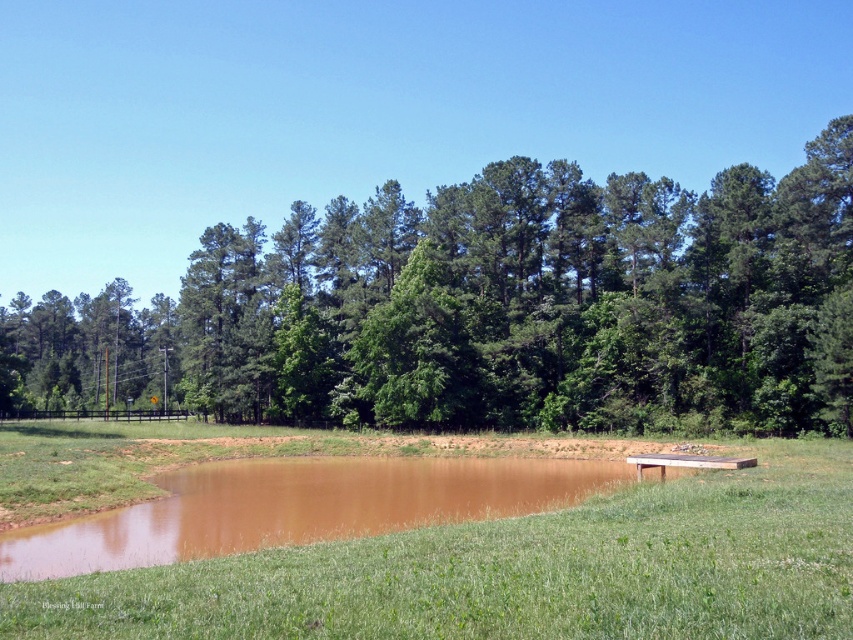
You are standing at the edge of the pond and want to walk towards the dense trees in the background. You see two points marked on the ground ahead of you. The first point is at coordinate point (585, 202) and the second is at point (22, 595). Which point is closer to your current position?

Point (585, 202) is closer to your current position because it is further to the camera than point (22, 595), meaning it is nearer to you.

You are standing at the edge of the muddy pond and want to reach the green leafy tree at center. Based on the distance provided, can you estimate how far you need to walk to reach it?

The green leafy tree at center is 192.00 feet away from you, so you need to walk approximately 192 feet to reach it.